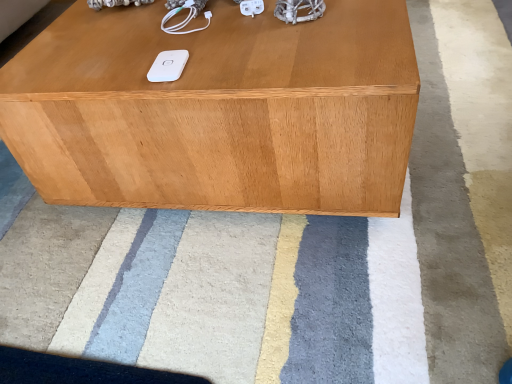
Locate an element on the screen. white soft rug at center is located at coordinates (260, 298).

Identify the location of white soft rug at center. (260, 298).

From the image's perspective, is white soft rug at center beneath white matte ipod at center?

Incorrect, from the image's perspective, white soft rug at center is higher than white matte ipod at center.

Is white soft rug at center placed right next to white matte ipod at center?

No, white soft rug at center is not next to white matte ipod at center.

Is white soft rug at center oriented towards white matte ipod at center?

No, white soft rug at center is not aimed at white matte ipod at center.

Consider the image. Who is taller, white matte ipod at center or light brown wood table at center?

With more height is light brown wood table at center.

Is point (166, 54) less distant than point (256, 46)?

No, (166, 54) is behind (256, 46).

Which is correct: white matte ipod at center is inside light brown wood table at center, or outside of it?

white matte ipod at center is spatially situated outside light brown wood table at center.

Is white matte ipod at center facing towards light brown wood table at center?

No, white matte ipod at center is not facing towards light brown wood table at center.

From a real-world perspective, who is located lower, light brown wood table at center or white soft rug at center?

white soft rug at center is physically lower.

From the image's perspective, is light brown wood table at center beneath white soft rug at center?

Actually, light brown wood table at center appears above white soft rug at center in the image.

The image size is (512, 384). I want to click on mat on the left side of light brown wood table at center, so click(260, 298).

Is point (361, 67) closer to camera compared to point (141, 330)?

Yes, it is in front of point (141, 330).

Considering the sizes of light brown wood table at center and white matte ipod at center in the image, is light brown wood table at center wider or thinner than white matte ipod at center?

Clearly, light brown wood table at center has more width compared to white matte ipod at center.

Is point (39, 169) less distant than point (165, 71)?

No, it is not.

From the image's perspective, is light brown wood table at center on white matte ipod at center?

Yes.

Which object is thinner, white matte ipod at center or white soft rug at center?

Thinner between the two is white matte ipod at center.

Considering the sizes of white matte ipod at center and white soft rug at center in the image, is white matte ipod at center taller or shorter than white soft rug at center?

Considering their sizes, white matte ipod at center has less height than white soft rug at center.

From a real-world perspective, which object stands above the other?

white matte ipod at center is physically above.

From the image's perspective, which is above, white matte ipod at center or white soft rug at center?

From the image's view, white soft rug at center is above.

Considering the relative positions of white soft rug at center and light brown wood table at center in the image provided, is white soft rug at center to the right of light brown wood table at center from the viewer's perspective?

Incorrect, white soft rug at center is not on the right side of light brown wood table at center.

The image size is (512, 384). Find the location of `mat that appears below the light brown wood table at center (from the image's perspective)`. mat that appears below the light brown wood table at center (from the image's perspective) is located at coordinates (260, 298).

How much distance is there between white soft rug at center and light brown wood table at center?

white soft rug at center and light brown wood table at center are 24.44 centimeters apart.

Which object is further away from the camera taking this photo, white soft rug at center or light brown wood table at center?

Positioned behind is light brown wood table at center.

This screenshot has width=512, height=384. I want to click on mat beneath the white matte ipod at center (from a real-world perspective), so click(260, 298).

This screenshot has height=384, width=512. Identify the location of ipod located on the left of light brown wood table at center. (168, 66).

Which object lies nearer to the anchor point light brown wood table at center, white matte ipod at center or white soft rug at center?

Based on the image, white matte ipod at center appears to be nearer to light brown wood table at center.

When comparing their distances from white soft rug at center, does light brown wood table at center or white matte ipod at center seem further?

Based on the image, white matte ipod at center appears to be further to white soft rug at center.

When comparing their distances from light brown wood table at center, does white soft rug at center or white matte ipod at center seem further?

white soft rug at center is further to light brown wood table at center.

When comparing their distances from white matte ipod at center, does light brown wood table at center or white soft rug at center seem closer?

Based on the image, light brown wood table at center appears to be nearer to white matte ipod at center.

Estimate the real-world distances between objects in this image. Which object is further from white matte ipod at center, white soft rug at center or light brown wood table at center?

white soft rug at center lies further to white matte ipod at center than the other object.

From the image, which object appears to be nearer to white soft rug at center, white matte ipod at center or light brown wood table at center?

light brown wood table at center is closer to white soft rug at center.

Where is `table between white soft rug at center and white matte ipod at center in the front-back direction`? The image size is (512, 384). table between white soft rug at center and white matte ipod at center in the front-back direction is located at coordinates (218, 111).